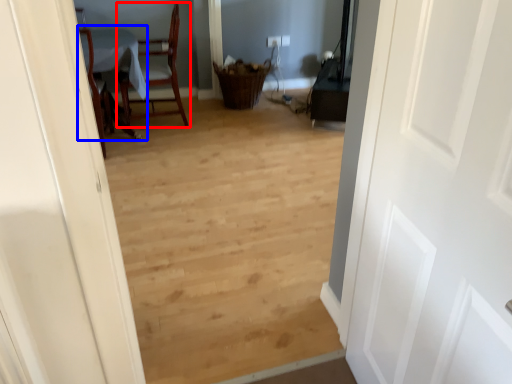
Question: Among these objects, which one is nearest to the camera, chair (highlighted by a red box) or table (highlighted by a blue box)?

Choices:
 (A) chair
 (B) table

Answer: (B)